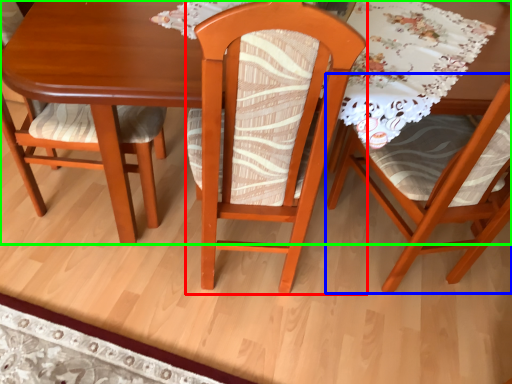
Question: Considering the real-world distances, which object is farthest from chair (highlighted by a red box)? chair (highlighted by a blue box) or table (highlighted by a green box)?

Choices:
 (A) chair
 (B) table

Answer: (A)